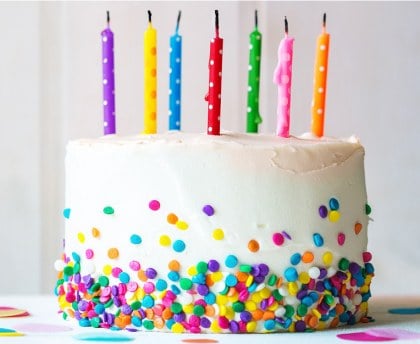
This screenshot has height=344, width=420. Find the location of `birthday candles`. birthday candles is located at coordinates (109, 87), (151, 87), (174, 85), (216, 85), (255, 82), (283, 83), (319, 80).